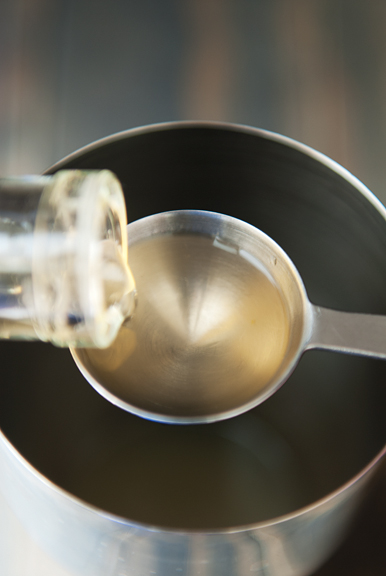
Find the location of a particular element. This screenshot has width=386, height=576. glare from light above is located at coordinates (208, 312).